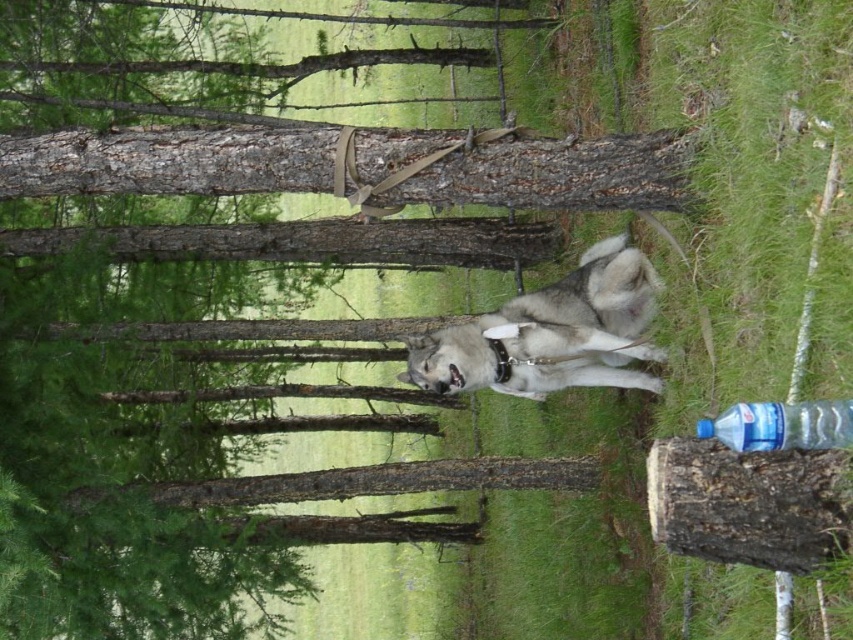
Who is shorter, smooth bark tree trunk at center or clear plastic bottle at lower right?

clear plastic bottle at lower right

Is smooth bark tree trunk at center to the right of clear plastic bottle at lower right from the viewer's perspective?

In fact, smooth bark tree trunk at center is to the left of clear plastic bottle at lower right.

Who is more forward, (33,150) or (697,424)?

Positioned in front is point (697,424).

You are a GUI agent. You are given a task and a screenshot of the screen. Output one action in this format:
    pyautogui.click(x=<x>, y=<y>)
    Task: Click on the smooth bark tree trunk at center
    This screenshot has width=853, height=640.
    Given the screenshot: What is the action you would take?
    pyautogui.click(x=167, y=161)

Which is above, rough bark log at lower right or sleek gray fur at center?

sleek gray fur at center is above.

Locate an element on the screen. The width and height of the screenshot is (853, 640). rough bark log at lower right is located at coordinates (749, 502).

Is point (619, 316) positioned after point (770, 428)?

Yes, point (619, 316) is behind point (770, 428).

Which is more to the left, white fur dog at center or clear plastic bottle at lower right?

From the viewer's perspective, white fur dog at center appears more on the left side.

Between point (595, 266) and point (701, 420), which one is positioned behind?

The point (595, 266) is more distant.

The width and height of the screenshot is (853, 640). What are the coordinates of `white fur dog at center` in the screenshot? It's located at (590, 294).